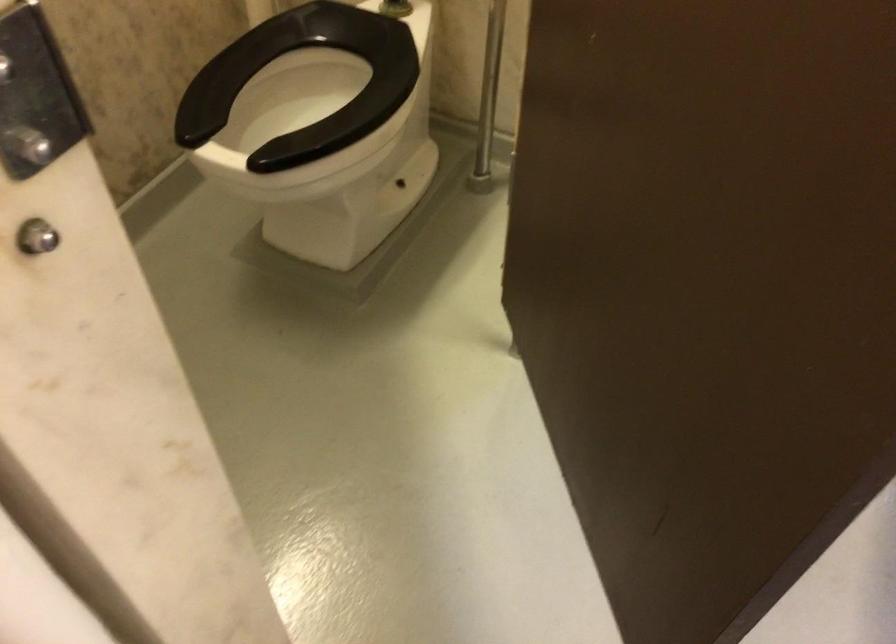
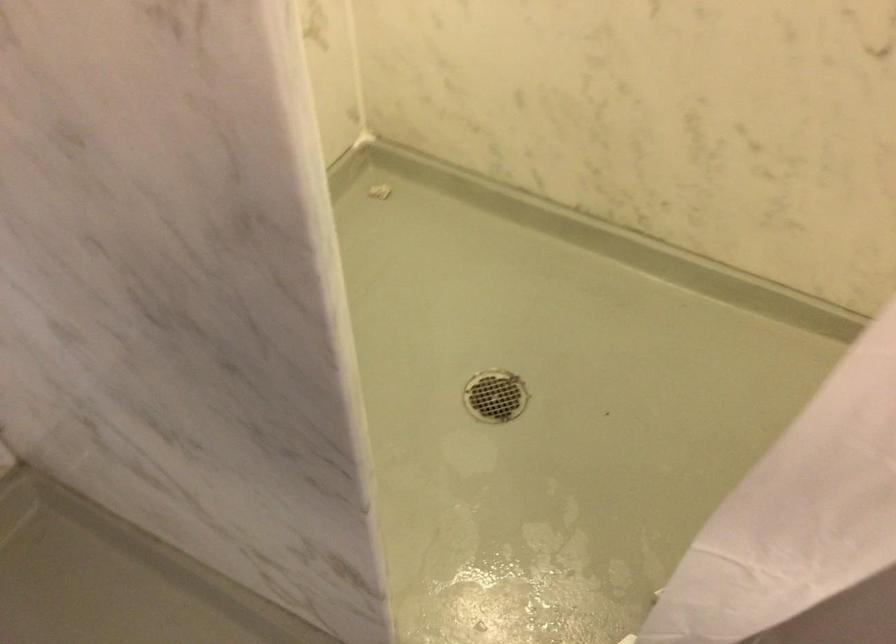
First-person continuous shooting, in which direction is the camera rotating?

The camera's rotation is toward left-down.